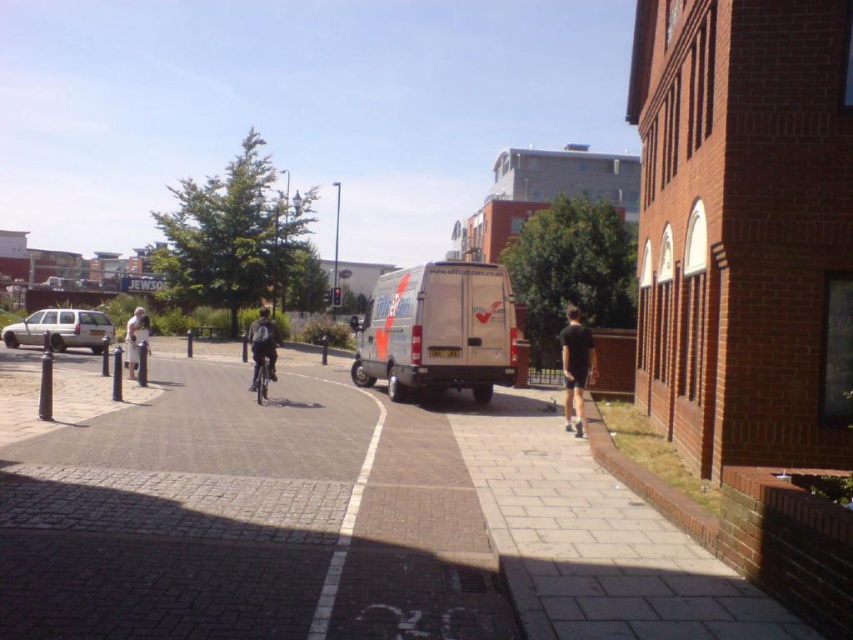
You are standing at point (341,524) in the urban street scene. What type of surface are you standing on?

The surface at point (341,524) is brick pavement at center.